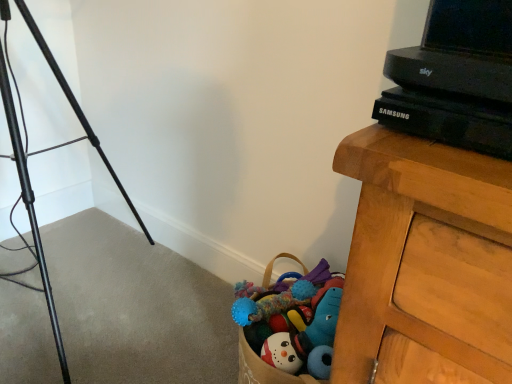
Describe the element at coordinates (455, 78) in the screenshot. The image size is (512, 384). I see `black plastic tv at upper right` at that location.

This screenshot has width=512, height=384. What are the coordinates of `black plastic tv at upper right` in the screenshot? It's located at (455, 78).

Find the location of `black metal tripod at left`. black metal tripod at left is located at coordinates [42, 152].

Image resolution: width=512 pixels, height=384 pixels. What do you see at coordinates (42, 152) in the screenshot?
I see `black metal tripod at left` at bounding box center [42, 152].

The image size is (512, 384). Find the location of `black plastic tv at upper right`. black plastic tv at upper right is located at coordinates (455, 78).

Considering the relative positions of black plastic tv at upper right and black metal tripod at left in the image provided, is black plastic tv at upper right to the left or to the right of black metal tripod at left?

Clearly, black plastic tv at upper right is on the right of black metal tripod at left in the image.

Considering the positions of objects black plastic tv at upper right and black metal tripod at left in the image provided, who is behind, black plastic tv at upper right or black metal tripod at left?

black metal tripod at left is more distant.

Is point (508, 70) positioned before point (39, 254)?

Yes, point (508, 70) is closer to viewer.

From the image's perspective, is black plastic tv at upper right located above or below black metal tripod at left?

From the image's perspective, black plastic tv at upper right appears above black metal tripod at left.

From a real-world perspective, which is physically above, black plastic tv at upper right or black metal tripod at left?

black plastic tv at upper right is physically above.

Considering the sizes of black plastic tv at upper right and black metal tripod at left in the image, is black plastic tv at upper right wider or thinner than black metal tripod at left?

Clearly, black plastic tv at upper right has less width compared to black metal tripod at left.

Is black plastic tv at upper right shorter than black metal tripod at left?

Yes.

Who is smaller, black plastic tv at upper right or black metal tripod at left?

black plastic tv at upper right is smaller.

Can we say black plastic tv at upper right lies outside black metal tripod at left?

Indeed, black plastic tv at upper right is completely outside black metal tripod at left.

Is there a large distance between black plastic tv at upper right and black metal tripod at left?

Yes, black plastic tv at upper right is far from black metal tripod at left.

Is black plastic tv at upper right facing towards black metal tripod at left?

No, black plastic tv at upper right is not turned towards black metal tripod at left.

In order to click on computer on the right of black metal tripod at left in this screenshot , I will do `click(455, 78)`.

In the image, is black metal tripod at left on the left side or the right side of black plastic tv at upper right?

black metal tripod at left is positioned on black plastic tv at upper right's left side.

Is black metal tripod at left in front of black plastic tv at upper right?

No, the depth of black metal tripod at left is greater than that of black plastic tv at upper right.

Between point (8, 115) and point (420, 128), which one is positioned behind?

Point (8, 115)

From the image's perspective, relative to black plastic tv at upper right, is black metal tripod at left above or below?

From the image's perspective, black metal tripod at left appears below black plastic tv at upper right.

From a real-world perspective, does black metal tripod at left stand above black plastic tv at upper right?

No.

Between black metal tripod at left and black plastic tv at upper right, which one has smaller width?

Thinner between the two is black plastic tv at upper right.

Considering the sizes of black metal tripod at left and black plastic tv at upper right in the image, is black metal tripod at left taller or shorter than black plastic tv at upper right?

In the image, black metal tripod at left appears to be taller than black plastic tv at upper right.

Considering the sizes of black metal tripod at left and black plastic tv at upper right in the image, is black metal tripod at left bigger or smaller than black plastic tv at upper right?

Considering their sizes, black metal tripod at left takes up more space than black plastic tv at upper right.

Do you think black metal tripod at left is within black plastic tv at upper right, or outside of it?

black metal tripod at left is not inside black plastic tv at upper right, it's outside.

Based on the photo, is black metal tripod at left placed right next to black plastic tv at upper right?

No, black metal tripod at left is not beside black plastic tv at upper right.

Could you tell me if black metal tripod at left is facing black plastic tv at upper right?

No, black metal tripod at left is not turned towards black plastic tv at upper right.

Can you tell me how much black metal tripod at left and black plastic tv at upper right differ in facing direction?

The facing directions of black metal tripod at left and black plastic tv at upper right are 56.3 degrees apart.

Where is `computer that is above the black metal tripod at left (from a real-world perspective)`? computer that is above the black metal tripod at left (from a real-world perspective) is located at coordinates (455, 78).

Find the location of a particular element. This screenshot has width=512, height=384. computer in front of the black metal tripod at left is located at coordinates 455,78.

Locate an element on the screen. tripod below the black plastic tv at upper right (from a real-world perspective) is located at coordinates (42, 152).